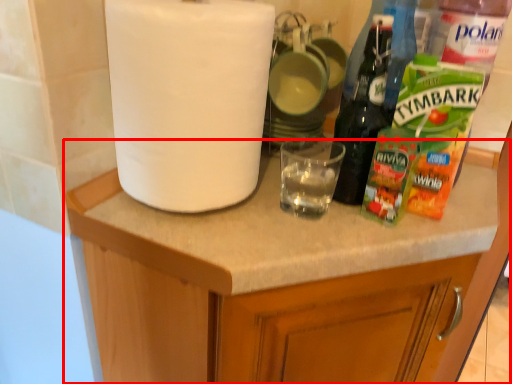
Question: From the image's perspective, considering the relative positions of cabinetry (annotated by the red box) and paper towel in the image provided, where is cabinetry (annotated by the red box) located with respect to the staircase?

Choices:
 (A) above
 (B) below

Answer: (B)